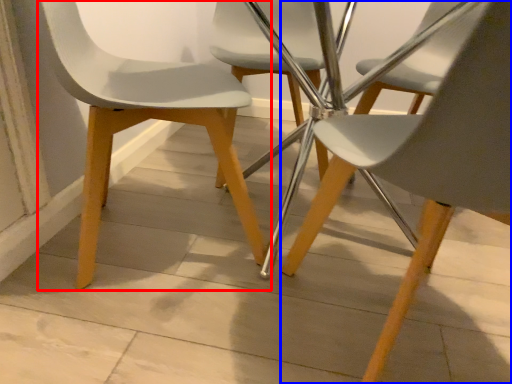
Question: Which of the following is the farthest to the observer, chair (highlighted by a red box) or chair (highlighted by a blue box)?

Choices:
 (A) chair
 (B) chair

Answer: (A)